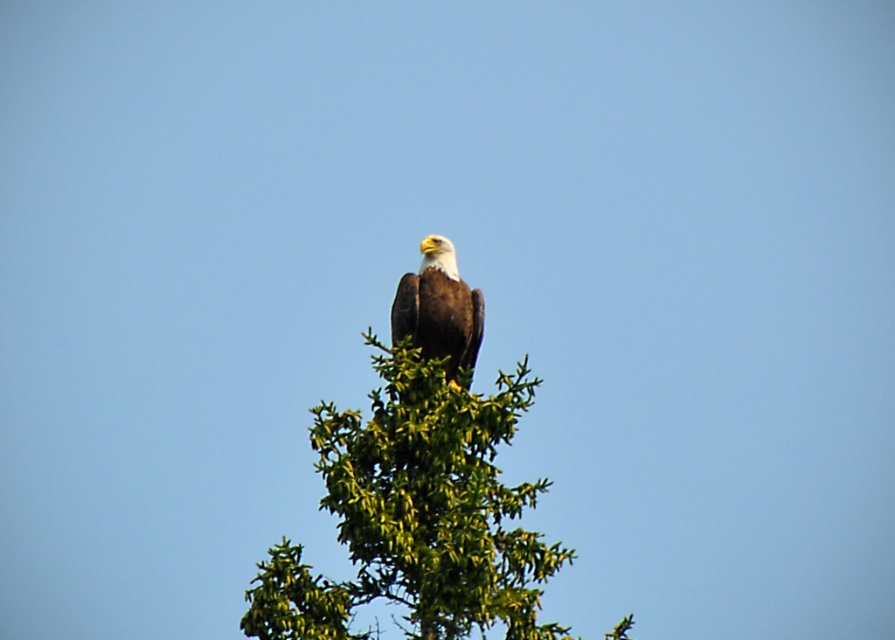
You are a birdwatcher trying to locate the bald eagle in the image. You notice a specific point marked at coordinates (x=416, y=515). Based on the scene, where is this point located?

The point at (x=416, y=515) is located on the green leafy tree at center, which is where the bald eagle is perched.

You are a birdwatcher trying to photograph the brown feathered eagle at center. You notice the green leafy tree at center in the background. Will the tree be taller than the eagle in your photo?

The green leafy tree at center is taller than the brown feathered eagle at center, so yes, the tree will appear taller than the eagle in the photo.

You are a photographer aiming to capture the bald eagle perched on the green leafy tree at center. If your camera is set to focus on the point at coordinates 0.805, 0.466, will the bald eagle be in focus?

The green leafy tree at center is positioned at point (x=416, y=515), so the camera will focus on the tree. Since the bald eagle is perched atop the tree, it will also be in focus at that point.